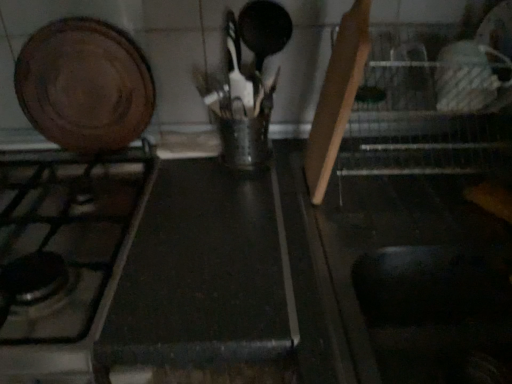
Question: Considering the relative positions of black matte counter top at center and wooden cutting board at upper left in the image provided, is black matte counter top at center to the right of wooden cutting board at upper left from the viewer's perspective?

Choices:
 (A) no
 (B) yes

Answer: (B)

Question: Considering the relative sizes of black matte counter top at center and wooden cutting board at upper left in the image provided, is black matte counter top at center smaller than wooden cutting board at upper left?

Choices:
 (A) yes
 (B) no

Answer: (B)

Question: Is wooden cutting board at upper left at the back of black matte counter top at center?

Choices:
 (A) no
 (B) yes

Answer: (A)

Question: From a real-world perspective, is black matte counter top at center located higher than wooden cutting board at upper left?

Choices:
 (A) no
 (B) yes

Answer: (A)

Question: Is black matte counter top at center far from wooden cutting board at upper left?

Choices:
 (A) no
 (B) yes

Answer: (A)

Question: Considering the positions of point (98, 269) and point (147, 120), is point (98, 269) closer or farther from the camera than point (147, 120)?

Choices:
 (A) farther
 (B) closer

Answer: (B)

Question: From a real-world perspective, is matte black gas stove at left physically located above or below wooden cutting board at upper left?

Choices:
 (A) below
 (B) above

Answer: (A)

Question: From their relative heights in the image, would you say matte black gas stove at left is taller or shorter than wooden cutting board at upper left?

Choices:
 (A) short
 (B) tall

Answer: (A)

Question: Visually, is matte black gas stove at left positioned to the left or to the right of wooden cutting board at upper left?

Choices:
 (A) left
 (B) right

Answer: (A)

Question: Is black matte counter top at center spatially inside matte black gas stove at left, or outside of it?

Choices:
 (A) inside
 (B) outside

Answer: (B)

Question: From a real-world perspective, is black matte counter top at center positioned above or below matte black gas stove at left?

Choices:
 (A) below
 (B) above

Answer: (A)

Question: Is point (123, 342) positioned closer to the camera than point (16, 292)?

Choices:
 (A) closer
 (B) farther

Answer: (A)

Question: From the image's perspective, is black matte counter top at center positioned above or below matte black gas stove at left?

Choices:
 (A) above
 (B) below

Answer: (B)

Question: From a real-world perspective, is black matte counter top at center above or below wooden cutting board at upper left?

Choices:
 (A) above
 (B) below

Answer: (B)

Question: In terms of width, does black matte counter top at center look wider or thinner when compared to wooden cutting board at upper left?

Choices:
 (A) wide
 (B) thin

Answer: (A)